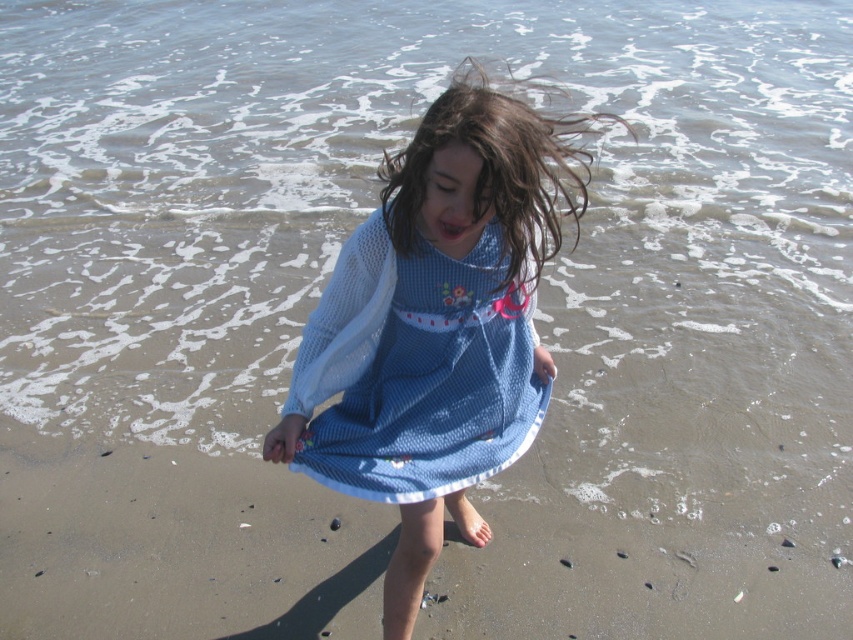
Question: Is blue woven dress at center behind blue mesh dress at center?

Choices:
 (A) no
 (B) yes

Answer: (A)

Question: Can you confirm if blue woven dress at center is smaller than blue mesh dress at center?

Choices:
 (A) no
 (B) yes

Answer: (A)

Question: Estimate the real-world distances between objects in this image. Which object is farther from the blue woven dress at center?

Choices:
 (A) blue mesh dress at center
 (B) wet brown hair at center

Answer: (B)

Question: Among these points, which one is farthest from the camera?

Choices:
 (A) (465, 289)
 (B) (502, 141)
 (C) (440, 352)

Answer: (C)

Question: Which object appears closest to the camera in this image?

Choices:
 (A) wet brown hair at center
 (B) blue mesh dress at center

Answer: (A)

Question: Does blue mesh dress at center have a greater width compared to wet brown hair at center?

Choices:
 (A) no
 (B) yes

Answer: (A)